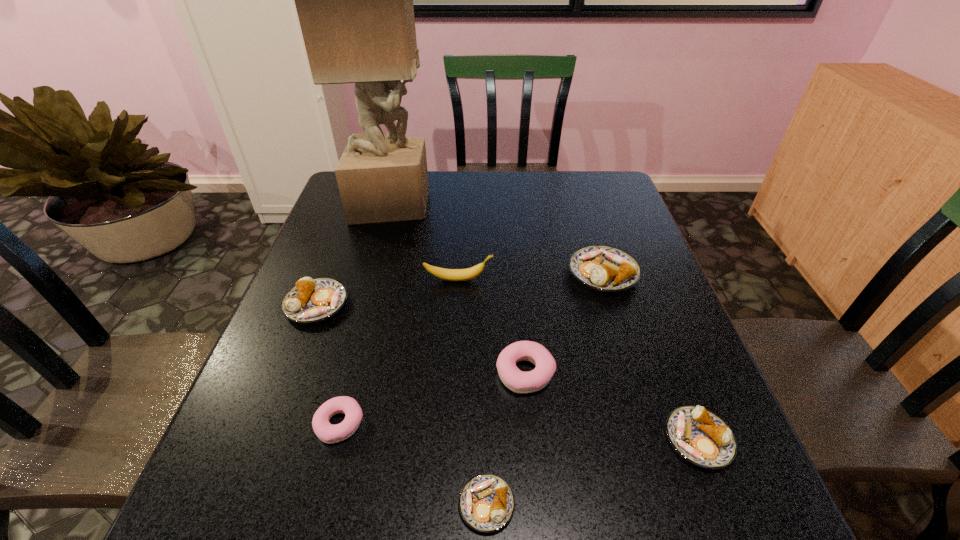
This screenshot has height=540, width=960. In order to click on vacant area located 0.070m on the left of the second nearest brown pastry in this screenshot , I will do `click(626, 440)`.

Locate an element on the screen. This screenshot has width=960, height=540. vacant space located on the right of the nearer pink pastry is located at coordinates (553, 424).

Find the location of `free space located on the right of the nearest brown pastry`. free space located on the right of the nearest brown pastry is located at coordinates (701, 504).

Where is `object present at the far edge`? The height and width of the screenshot is (540, 960). object present at the far edge is located at coordinates (354, 0).

Identify the location of object that is positioned at the near edge. (486, 502).

Where is `sculpture located at the left edge`? This screenshot has height=540, width=960. sculpture located at the left edge is located at coordinates (354, 0).

Identify the location of object that is at the far left corner. (354, 0).

Identify the location of vacant area at the far edge of the desktop. This screenshot has width=960, height=540. pos(450,171).

Find the location of a particular element. vacant space at the near edge of the desktop is located at coordinates (462, 487).

In the image, there is a desktop. Where is `vacant area at the left edge`? This screenshot has width=960, height=540. vacant area at the left edge is located at coordinates (365, 267).